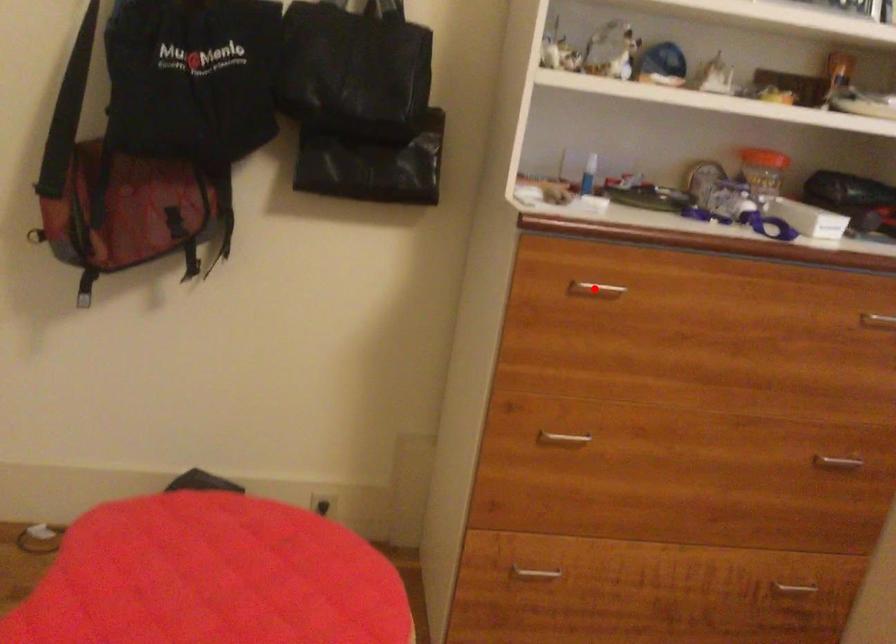
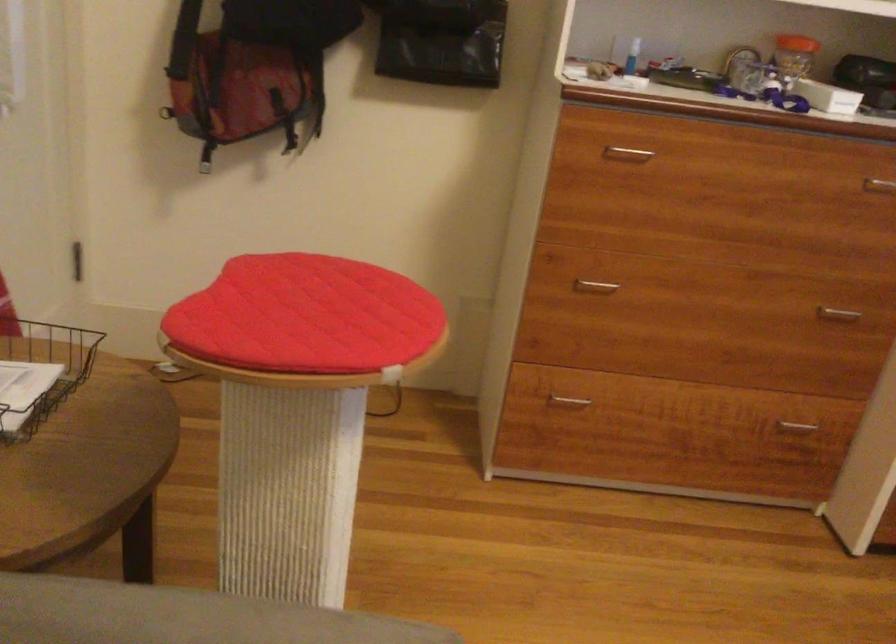
Question: A red point is marked in image1. In image2, is the corresponding 3D point closer to the camera or farther? Reply with the corresponding letter.

Choices:
 (A) The corresponding 3D point is closer.
 (B) The corresponding 3D point is farther.

Answer: (B)